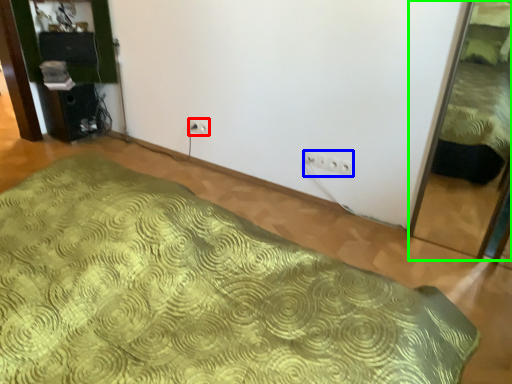
Question: Which object is positioned closest to electric outlet (highlighted by a red box)? Select from electric outlet (highlighted by a blue box) and bed (highlighted by a green box).

Choices:
 (A) electric outlet
 (B) bed

Answer: (A)